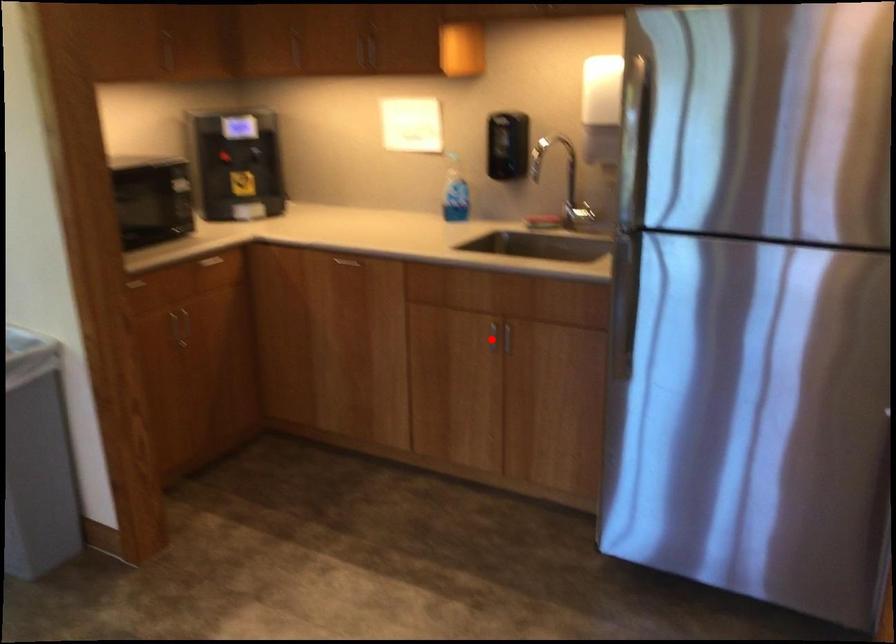
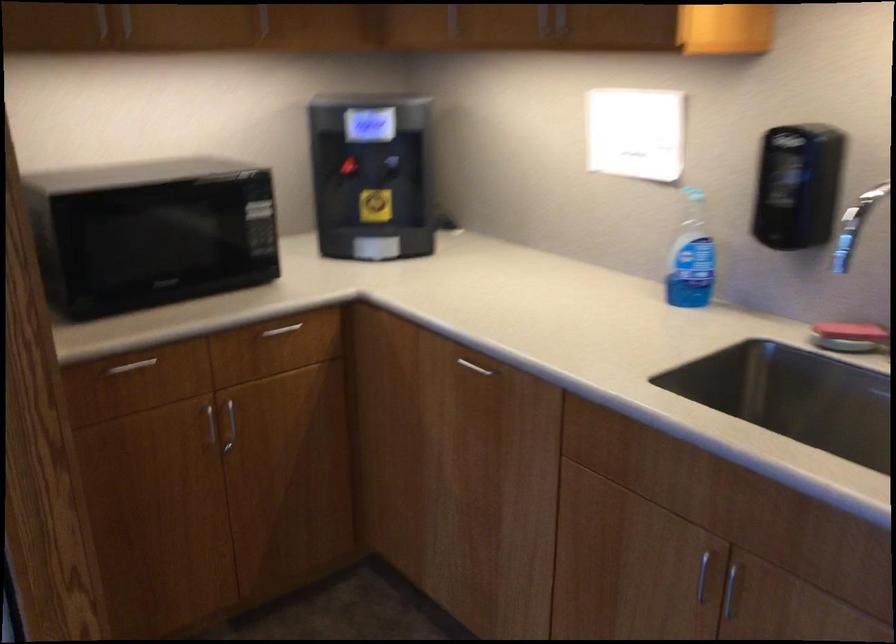
Question: I am providing you with two images of the same scene from different viewpoints. A red point is shown in image1. For the corresponding object point in image2, is it positioned nearer or farther from the camera?

Choices:
 (A) Nearer
 (B) Farther

Answer: (A)